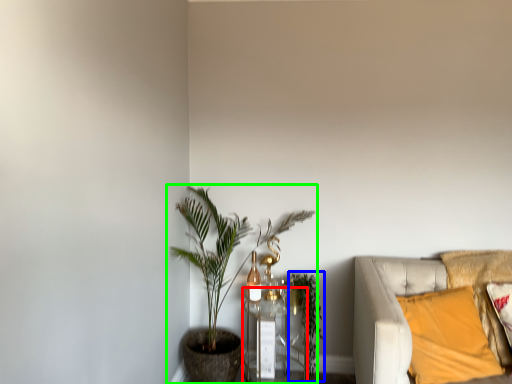
Question: Considering the real-world distances, which object is farthest from table (highlighted by a red box)? vegetation (highlighted by a blue box) or houseplant (highlighted by a green box)?

Choices:
 (A) vegetation
 (B) houseplant

Answer: (B)